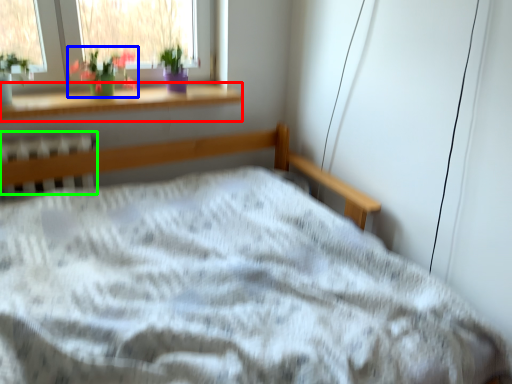
Question: Which object is the closest to the window sill (highlighted by a red box)? Choose among these: floral arrangement (highlighted by a blue box) or radiator (highlighted by a green box).

Choices:
 (A) floral arrangement
 (B) radiator

Answer: (A)